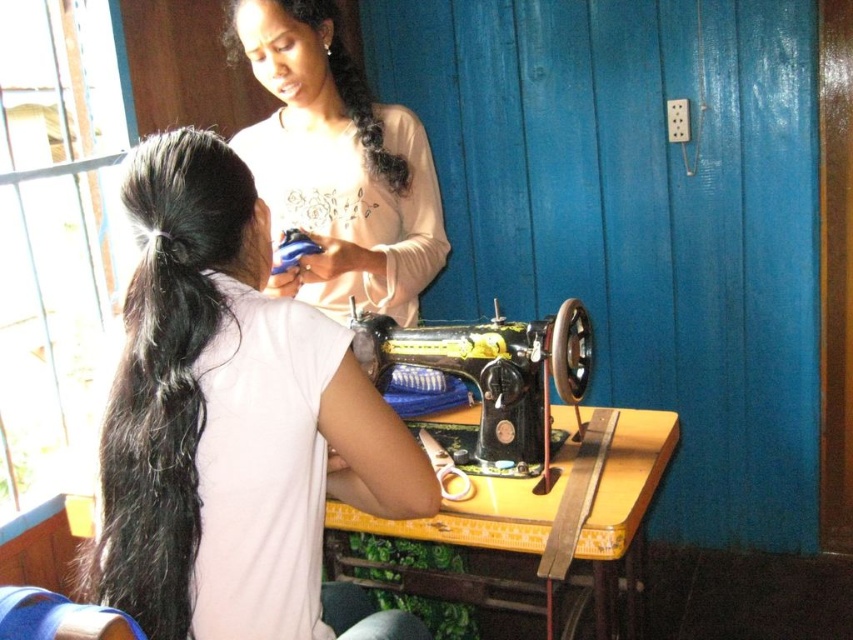
Can you confirm if matte white shirt at upper center is positioned to the left of black curly hair at upper center?

Incorrect, matte white shirt at upper center is not on the left side of black curly hair at upper center.

Is matte white shirt at upper center bigger than black curly hair at upper center?

Yes.

Which is behind, point (271, 51) or point (310, 24)?

The point (310, 24) is behind.

Locate an element on the screen. This screenshot has width=853, height=640. matte white shirt at upper center is located at coordinates (337, 164).

Is white matte shirt at upper left below matte white shirt at upper center?

Indeed, white matte shirt at upper left is positioned under matte white shirt at upper center.

Can you confirm if white matte shirt at upper left is thinner than matte white shirt at upper center?

Yes, white matte shirt at upper left is thinner than matte white shirt at upper center.

Is point (131, 413) farther from camera compared to point (367, 116)?

No.

Identify the location of white matte shirt at upper left. The width and height of the screenshot is (853, 640). (231, 422).

Consider the image. Does white matte shirt at upper left come in front of black metal sewing machine at center?

That is True.

Does white matte shirt at upper left appear on the left side of black metal sewing machine at center?

Indeed, white matte shirt at upper left is positioned on the left side of black metal sewing machine at center.

Locate an element on the screen. white matte shirt at upper left is located at coordinates (231, 422).

Image resolution: width=853 pixels, height=640 pixels. I want to click on white matte shirt at upper left, so click(231, 422).